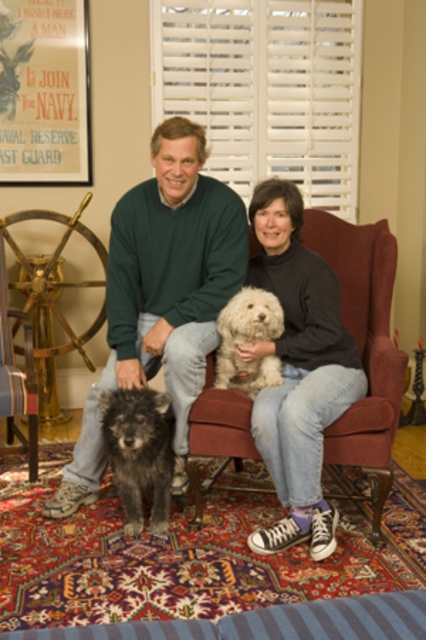
Question: Is striped fabric at lower center thinner than fuzzy dark brown dog at lower left?

Choices:
 (A) yes
 (B) no

Answer: (B)

Question: From the image, what is the correct spatial relationship of striped fabric at lower center in relation to fuzzy dark brown dog at lower left?

Choices:
 (A) right
 (B) left

Answer: (A)

Question: Which object appears closest to the camera in this image?

Choices:
 (A) matte black turtleneck at center
 (B) fuzzy dark brown dog at lower left
 (C) matte green sweater at center
 (D) striped fabric at lower center

Answer: (D)

Question: Which object appears closest to the camera in this image?

Choices:
 (A) white fluffy dog at center
 (B) wooden armchair at lower left
 (C) matte green sweater at center

Answer: (C)

Question: Does striped fabric at lower center appear on the left side of fuzzy dark brown dog at lower left?

Choices:
 (A) no
 (B) yes

Answer: (A)

Question: Which object is the farthest from the striped fabric at lower center?

Choices:
 (A) white fluffy dog at center
 (B) matte black turtleneck at center

Answer: (A)